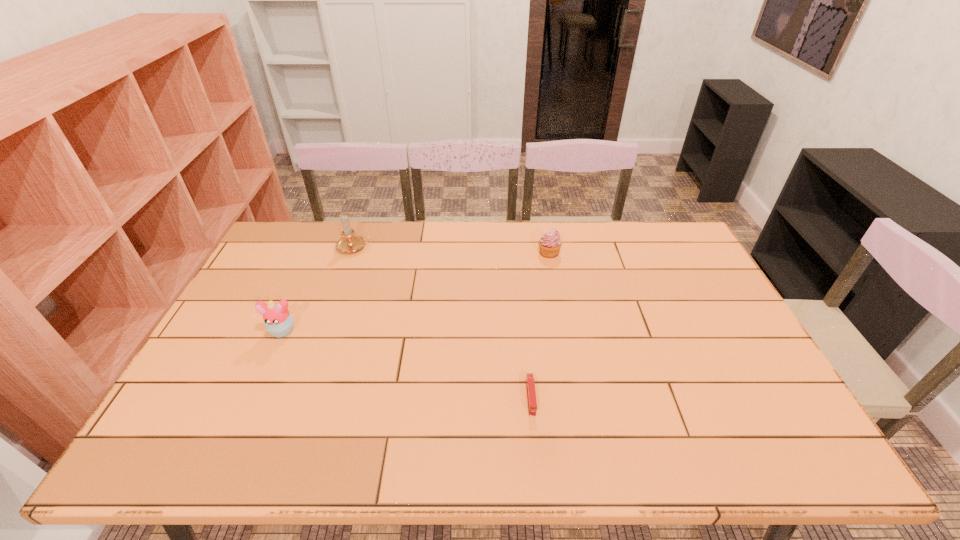
Locate an element on the screen. object that is the third closest to the shorter cupcake is located at coordinates (279, 322).